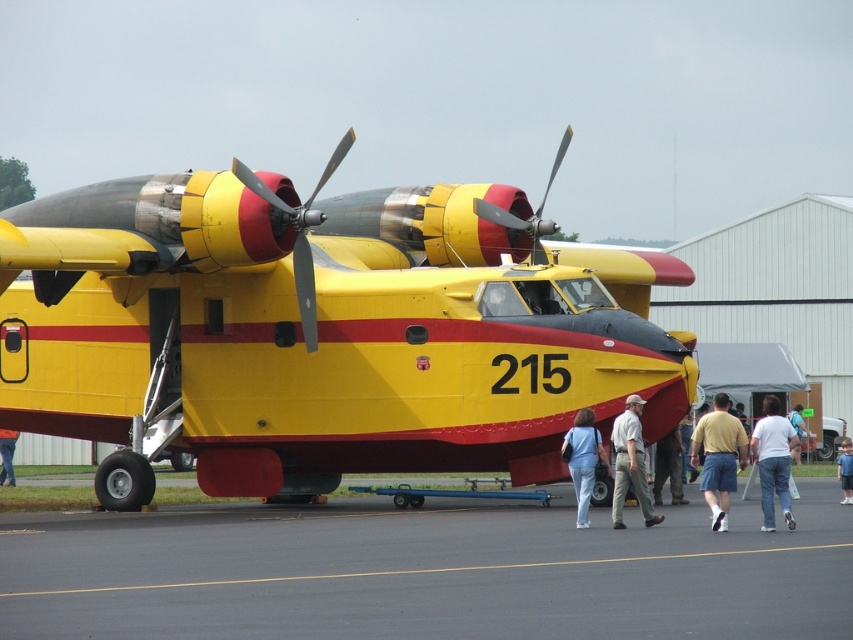
Does yellow matte propeller at center appear on the left side of denim shorts at center?

Indeed, yellow matte propeller at center is positioned on the left side of denim shorts at center.

Does yellow matte propeller at center appear over denim shorts at center?

Correct, yellow matte propeller at center is located above denim shorts at center.

Measure the distance between yellow matte propeller at center and camera.

They are 27.07 meters apart.

The width and height of the screenshot is (853, 640). In order to click on yellow matte propeller at center in this screenshot , I will do `click(531, 216)`.

Is point (308, 276) positioned behind point (848, 456)?

No, it is not.

Who is more distant from viewer, (289, 211) or (844, 454)?

Positioned behind is point (844, 454).

Identify the location of metallic silver propeller at center. The width and height of the screenshot is (853, 640). (299, 232).

Which is more to the right, black asphalt tarmac at lower center or light gray cotton shirt at center?

Positioned to the right is light gray cotton shirt at center.

Who is more forward, (x=641, y=612) or (x=635, y=456)?

Point (x=641, y=612) is more forward.

Is point (555, 614) in front of point (634, 426)?

That is True.

You are a GUI agent. You are given a task and a screenshot of the screen. Output one action in this format:
    pyautogui.click(x=<x>, y=<y>)
    Task: Click on the black asphalt tarmac at lower center
    The height and width of the screenshot is (640, 853).
    Given the screenshot: What is the action you would take?
    pyautogui.click(x=426, y=572)